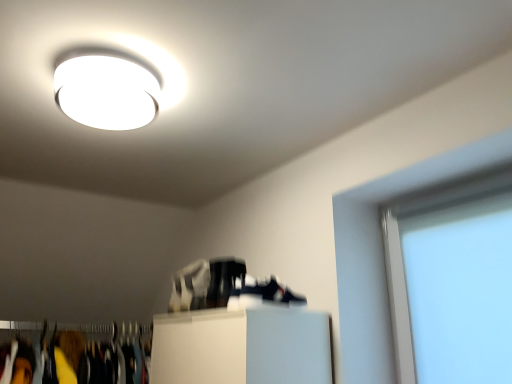
Question: Does transparent glass window screen at right have a lesser height compared to white matte shoe at center, acting as the first shoe starting from the left?

Choices:
 (A) yes
 (B) no

Answer: (B)

Question: Considering the relative sizes of transparent glass window screen at right and white matte shoe at center, the 1th shoe when ordered from back to front, in the image provided, is transparent glass window screen at right bigger than white matte shoe at center, the 1th shoe when ordered from back to front,?

Choices:
 (A) no
 (B) yes

Answer: (B)

Question: Considering the relative positions of transparent glass window screen at right and white matte shoe at center, the second shoe in the right-to-left sequence, in the image provided, is transparent glass window screen at right to the left of white matte shoe at center, the second shoe in the right-to-left sequence, from the viewer's perspective?

Choices:
 (A) no
 (B) yes

Answer: (A)

Question: Is transparent glass window screen at right taller than white matte shoe at center, the 2th shoe positioned from the front?

Choices:
 (A) yes
 (B) no

Answer: (A)

Question: From the image's perspective, does transparent glass window screen at right appear lower than white matte shoe at center, the second shoe in the right-to-left sequence?

Choices:
 (A) yes
 (B) no

Answer: (B)

Question: Would you say shiny black shoe at center, the 1th shoe in the front-to-back sequence, is inside or outside white glossy ceiling light at upper center?

Choices:
 (A) outside
 (B) inside

Answer: (A)

Question: Looking at the image, does shiny black shoe at center, the 1th shoe in the front-to-back sequence, seem bigger or smaller compared to white glossy ceiling light at upper center?

Choices:
 (A) big
 (B) small

Answer: (B)

Question: From a real-world perspective, relative to white glossy ceiling light at upper center, is shiny black shoe at center, the 1th shoe in the front-to-back sequence, vertically above or below?

Choices:
 (A) above
 (B) below

Answer: (B)

Question: Is point (223, 294) positioned closer to the camera than point (86, 112)?

Choices:
 (A) closer
 (B) farther

Answer: (B)

Question: From a real-world perspective, is transparent glass window screen at right above or below white matte shoe at center, the second shoe in the right-to-left sequence?

Choices:
 (A) below
 (B) above

Answer: (A)

Question: In terms of width, does transparent glass window screen at right look wider or thinner when compared to white matte shoe at center, acting as the first shoe starting from the left?

Choices:
 (A) thin
 (B) wide

Answer: (A)

Question: Which is correct: transparent glass window screen at right is inside white matte shoe at center, the second shoe in the right-to-left sequence, or outside of it?

Choices:
 (A) outside
 (B) inside

Answer: (A)

Question: Would you say transparent glass window screen at right is to the left or to the right of white matte shoe at center, acting as the first shoe starting from the left, in the picture?

Choices:
 (A) right
 (B) left

Answer: (A)

Question: From their relative heights in the image, would you say white matte shoe at center, acting as the first shoe starting from the left, is taller or shorter than shiny black shoe at center, which is the second shoe from back to front?

Choices:
 (A) tall
 (B) short

Answer: (A)

Question: Considering the positions of white matte shoe at center, acting as the first shoe starting from the left, and shiny black shoe at center, arranged as the second shoe when viewed from the left, in the image, is white matte shoe at center, acting as the first shoe starting from the left, bigger or smaller than shiny black shoe at center, arranged as the second shoe when viewed from the left,?

Choices:
 (A) small
 (B) big

Answer: (B)